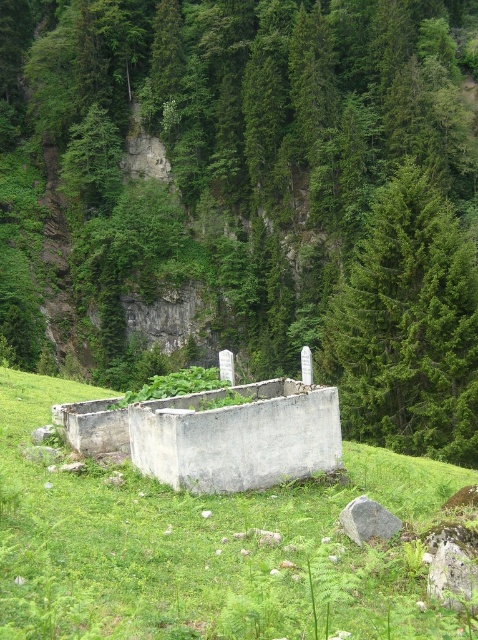
Is point (423, 417) less distant than point (369, 531)?

No, it is not.

Image resolution: width=478 pixels, height=640 pixels. What do you see at coordinates (408, 326) in the screenshot?
I see `green evergreen tree at upper right` at bounding box center [408, 326].

Measure the distance between green evergreen tree at upper right and camera.

green evergreen tree at upper right and camera are 64.85 feet apart.

Find the location of a particular element. green evergreen tree at upper right is located at coordinates (408, 326).

Which is above, green leafy tree at center or gray rough rock at lower center?

Positioned higher is green leafy tree at center.

Can you confirm if green leafy tree at center is positioned above gray rough rock at lower center?

Indeed, green leafy tree at center is positioned over gray rough rock at lower center.

This screenshot has width=478, height=640. I want to click on green leafy tree at center, so click(252, 193).

Which is below, green leafy tree at center or green grassy at center?

green grassy at center is below.

Is the position of green leafy tree at center more distant than that of green grassy at center?

Yes, green leafy tree at center is further from the viewer.

Is point (449, 45) positioned after point (393, 512)?

Yes, point (449, 45) is farther from viewer.

Locate an element on the screen. green leafy tree at center is located at coordinates (252, 193).